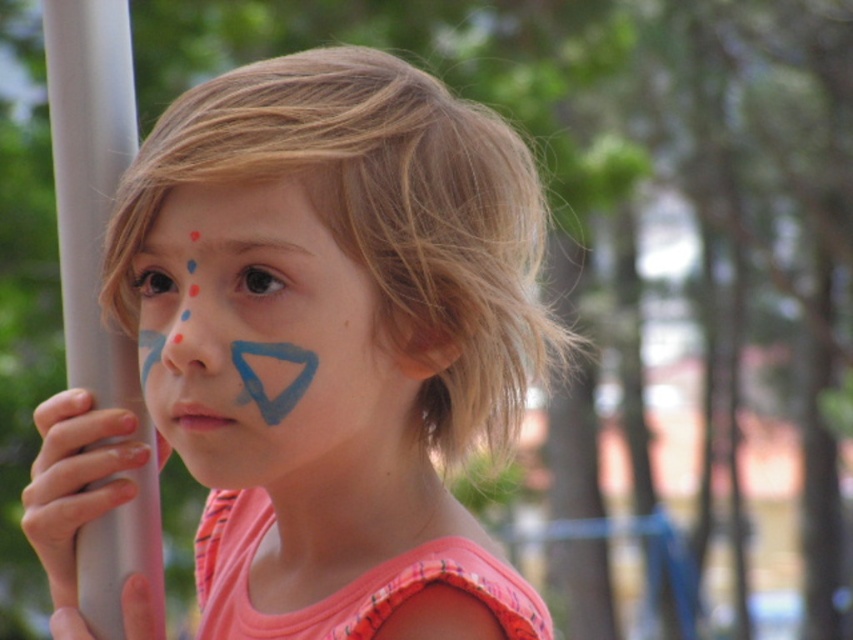
Does point (219, 440) come in front of point (132, 637)?

That is True.

Which of these two, blue matte triangle at center or smooth gray pole at left, stands shorter?

smooth gray pole at left is shorter.

Where is `blue matte triangle at center`? This screenshot has width=853, height=640. blue matte triangle at center is located at coordinates (265, 342).

Can you confirm if white matte pole at left is bigger than smooth gray pole at left?

Yes.

Measure the distance between white matte pole at left and camera.

white matte pole at left is 88.19 centimeters away from camera.

Find the location of a particular element. This screenshot has height=640, width=853. white matte pole at left is located at coordinates (74, 481).

Does blue matte triangle at center appear on the right side of white plastic pole at left?

Indeed, blue matte triangle at center is positioned on the right side of white plastic pole at left.

Which of these two, blue matte triangle at center or white plastic pole at left, stands taller?

Standing taller between the two is white plastic pole at left.

Describe the element at coordinates (265, 342) in the screenshot. Image resolution: width=853 pixels, height=640 pixels. I see `blue matte triangle at center` at that location.

The height and width of the screenshot is (640, 853). Identify the location of blue matte triangle at center. (265, 342).